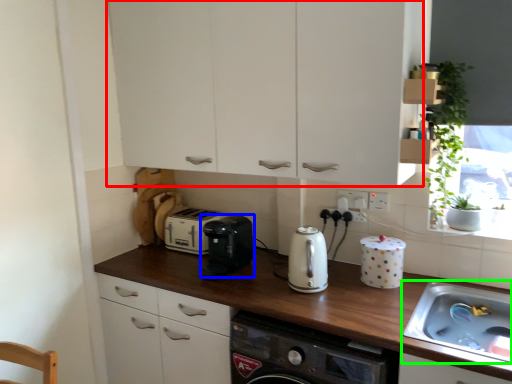
Question: Which object is the farthest from cabinetry (highlighted by a red box)? Choose among these: kitchen appliance (highlighted by a blue box) or sink (highlighted by a green box).

Choices:
 (A) kitchen appliance
 (B) sink

Answer: (B)